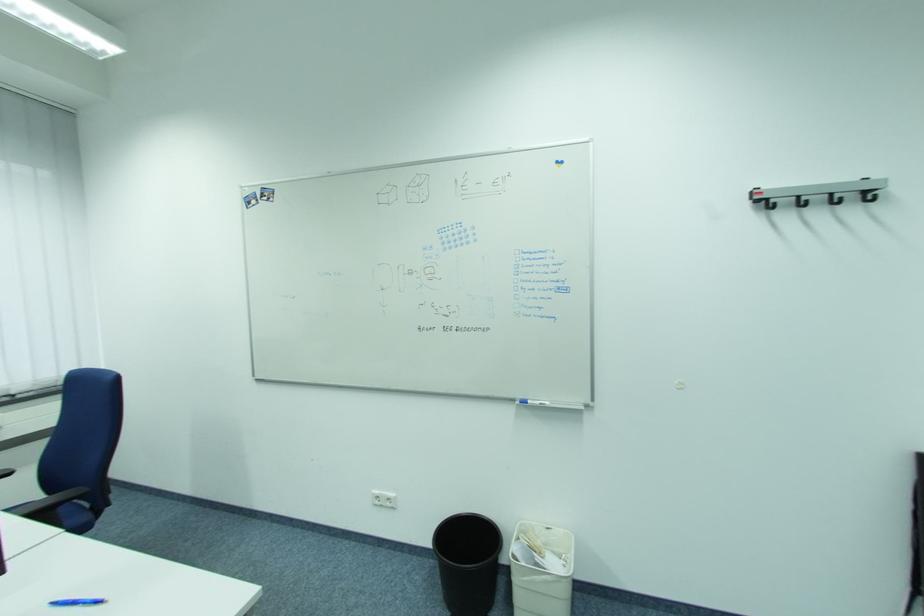
Find where to lift the blue pen. Please return your answer as a coordinate pair (x, y).

(78, 602)